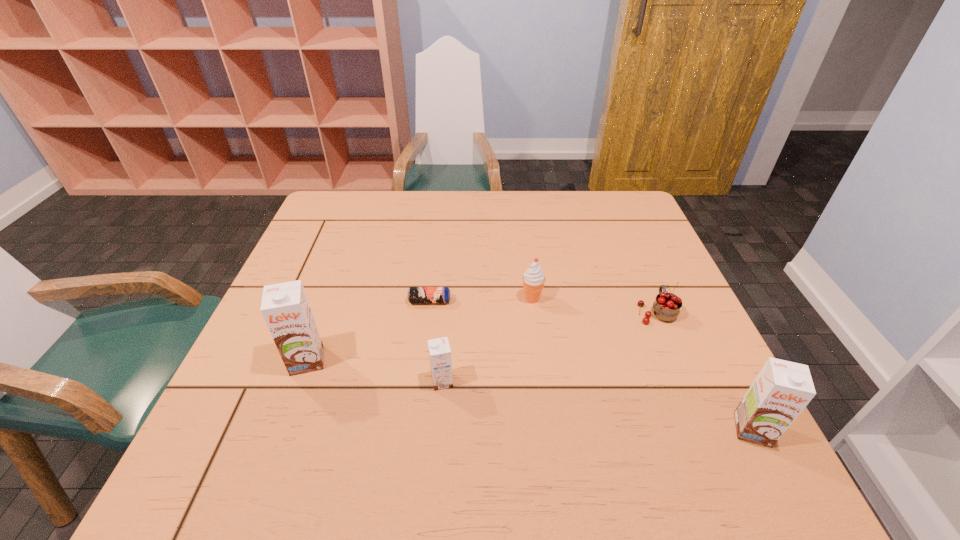
To make them evenly spaced by inserting another chocolate_milk among them, please locate a free space for this new chocolate_milk. Please provide its 2D coordinates. Your answer should be formatted as a tuple, i.e. [(x, y)], where the tuple contains the x and y coordinates of a point satisfying the conditions above.

[(590, 404)]